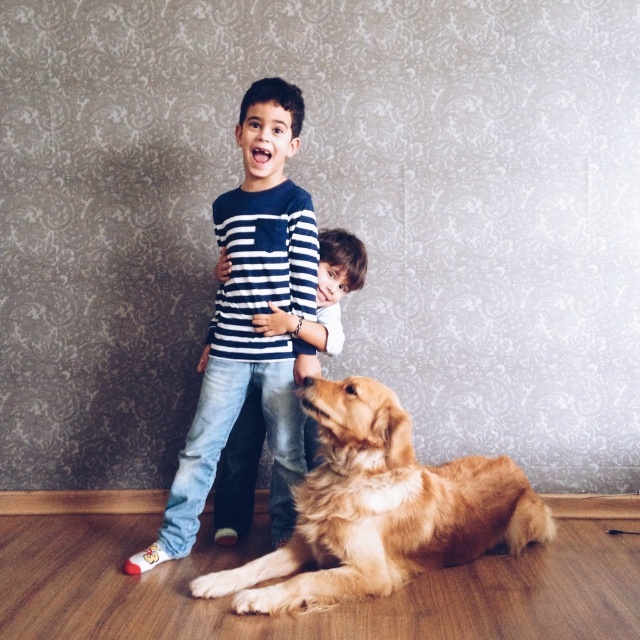
Question: Considering the relative positions of golden fur dog at lower center and smooth golden dog at lower center in the image provided, where is golden fur dog at lower center located with respect to smooth golden dog at lower center?

Choices:
 (A) below
 (B) above

Answer: (B)

Question: Estimate the real-world distances between objects in this image. Which object is farther from the golden fur dog at lower center?

Choices:
 (A) smooth golden dog at lower center
 (B) striped cotton shirt at center

Answer: (A)

Question: Which is nearer to the striped cotton shirt at center?

Choices:
 (A) golden fur dog at lower center
 (B) smooth golden dog at lower center

Answer: (B)

Question: Among these objects, which one is farthest from the camera?

Choices:
 (A) striped cotton shirt at center
 (B) golden fur dog at lower center
 (C) smooth golden dog at lower center

Answer: (C)

Question: Can you confirm if striped cotton shirt at center is smaller than smooth golden dog at lower center?

Choices:
 (A) yes
 (B) no

Answer: (B)

Question: Does golden fur dog at lower center appear on the right side of striped cotton shirt at center?

Choices:
 (A) yes
 (B) no

Answer: (A)